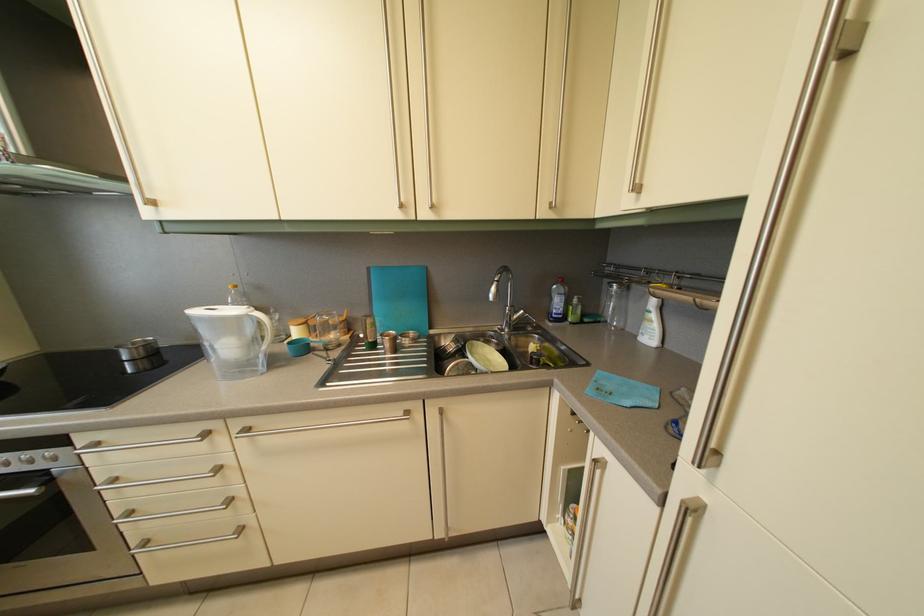
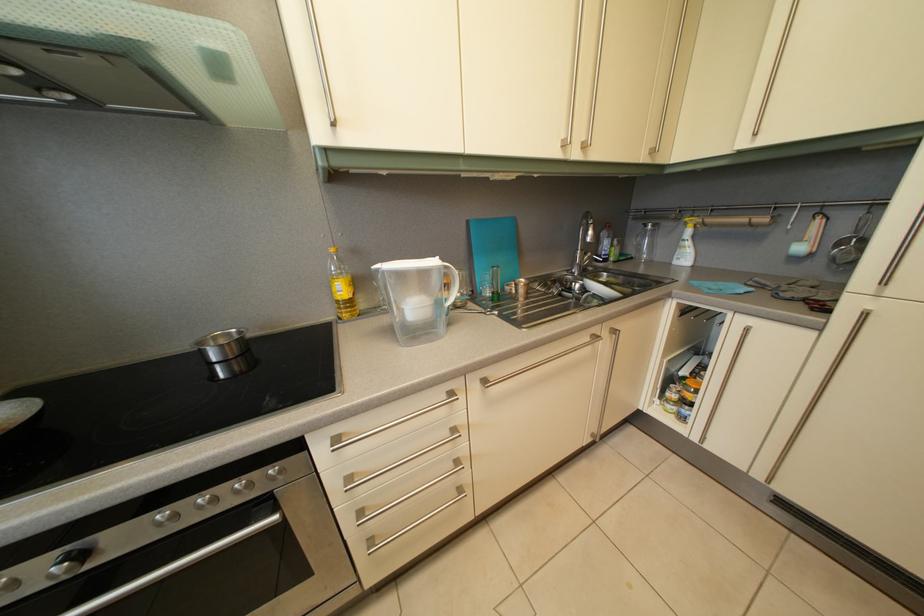
The point at (142, 351) is marked in the first image. Where is the corresponding point in the second image?

(224, 346)